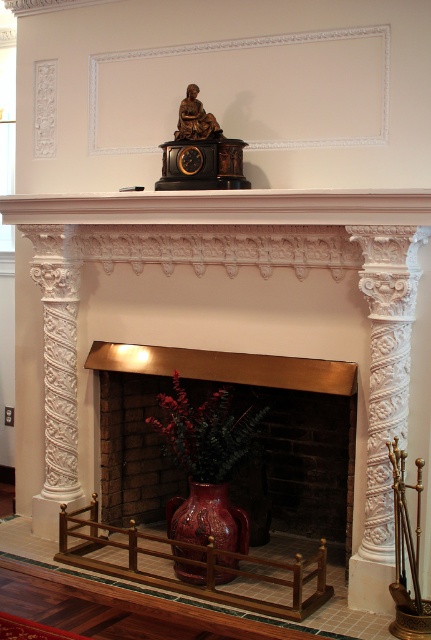
Question: Considering the relative positions of white carved stone column at center and glossy ceramic vase at center in the image provided, where is white carved stone column at center located with respect to glossy ceramic vase at center?

Choices:
 (A) above
 (B) below

Answer: (A)

Question: Which point is closer to the camera?

Choices:
 (A) 181,552
 (B) 190,161
 (C) 336,380
 (D) 380,196

Answer: (D)

Question: Which object appears closest to the camera in this image?

Choices:
 (A) white carved stone column at center
 (B) matte red vase at center

Answer: (B)

Question: Considering the real-world distances, which object is farthest from the white carved wood mantle at upper center?

Choices:
 (A) white carved stone column at right
 (B) matte brown clock at upper center
 (C) white carved stone column at center

Answer: (C)

Question: Can you confirm if white carved wood mantle at upper center is positioned below glossy ceramic vase at center?

Choices:
 (A) no
 (B) yes

Answer: (A)

Question: Observing the image, what is the correct spatial positioning of white carved stone column at center in reference to matte brown clock at upper center?

Choices:
 (A) right
 (B) left

Answer: (B)